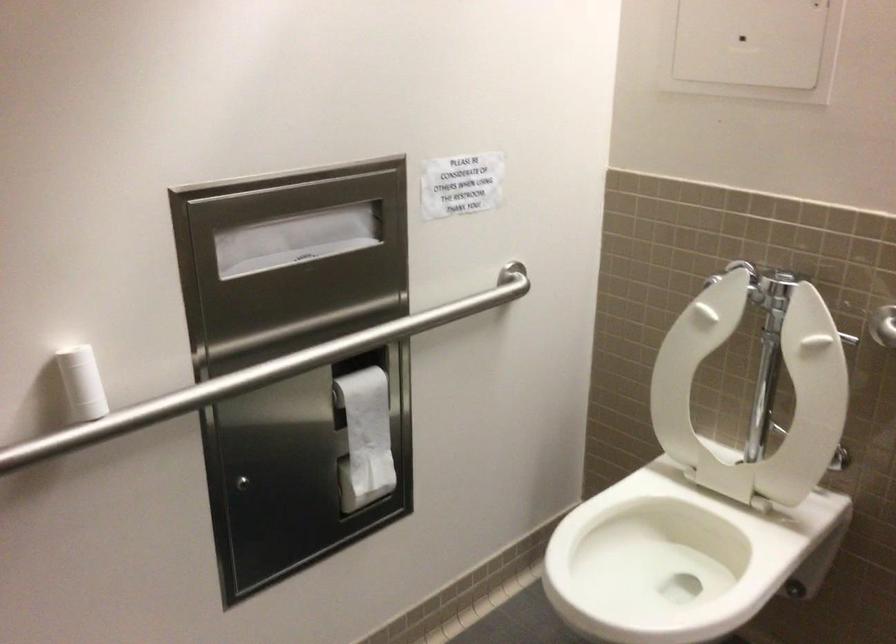
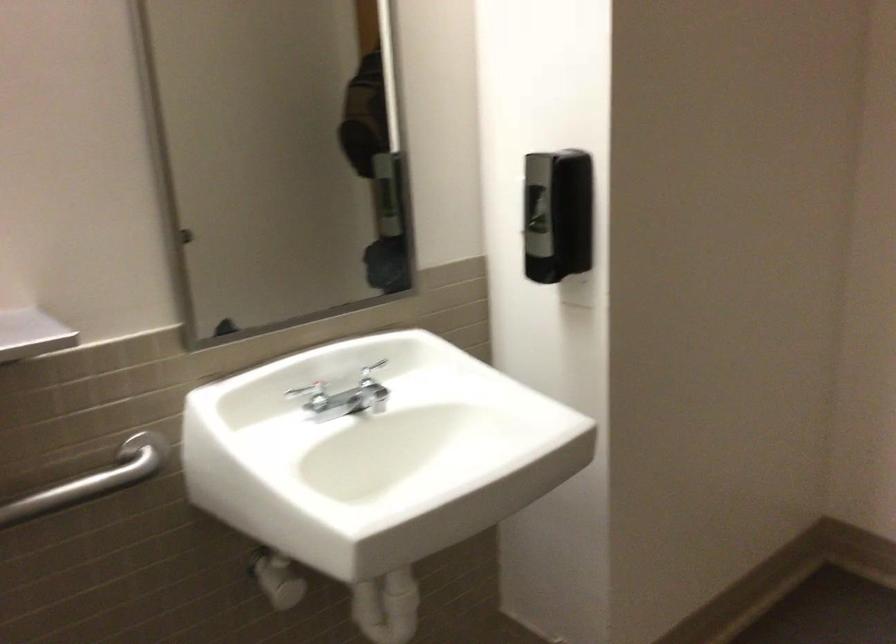
Question: How did the camera likely rotate?

Choices:
 (A) Left
 (B) Right
 (C) Up
 (D) Down

Answer: (B)